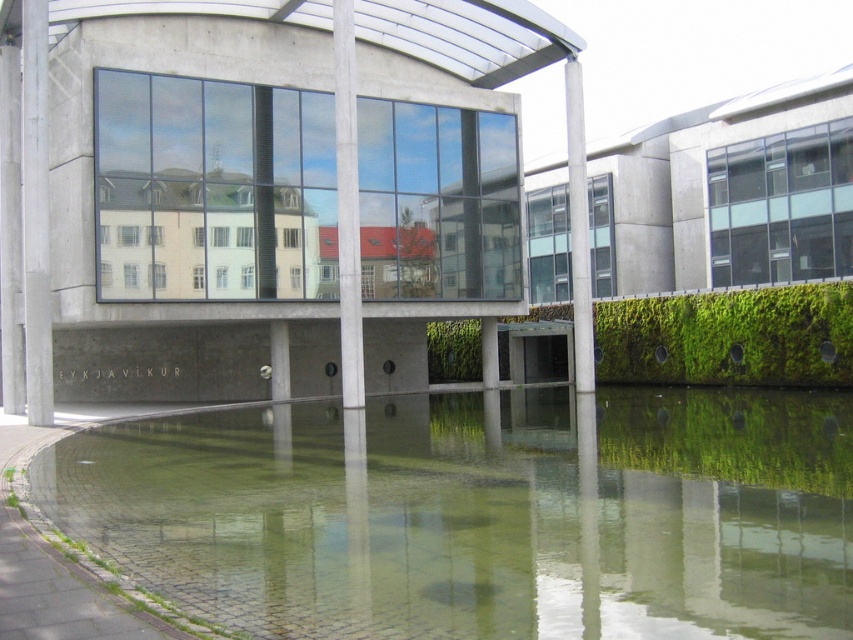
You are a construction worker needing to place a 10 meter long safety barrier between the concrete pillar at left and the smooth concrete pillar at center. Based on the scene, will the barrier fit between them?

The distance between the concrete pillar at left and the smooth concrete pillar at center is 8.22 meters. Since the safety barrier is 10 meters long, it will not fit between them as the distance is shorter than the barrier.

You are a delivery drone that needs to land between the smooth concrete pillar at center and the gray concrete pillar at center. The minimum distance required for a safe landing is 10 meters. Can you safely land between them?

The smooth concrete pillar at center and gray concrete pillar at center are 10.49 meters apart from each other. Since the required distance for a safe landing is 10 meters, the 10.49 meters distance is sufficient. Therefore, the drone can safely land between them.

You are an architect designing a new plaza and need to place a bench between the concrete pillar at left and the gray concrete pillar at center. Which pillar should the bench be closer to if you want it to be near the wider pillar?

The bench should be placed closer to the concrete pillar at left because its width is larger than the gray concrete pillar at center.